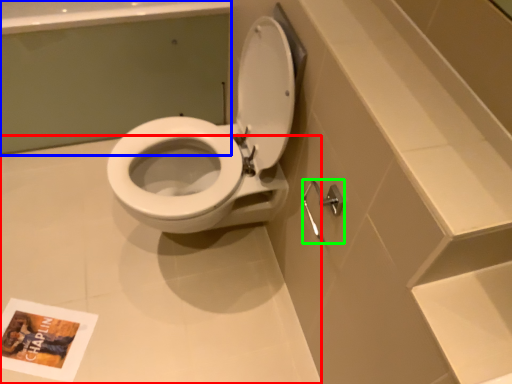
Question: Which object is the closest to the plain (highlighted by a red box)? Choose among these: bath (highlighted by a blue box) or shower (highlighted by a green box).

Choices:
 (A) bath
 (B) shower

Answer: (A)